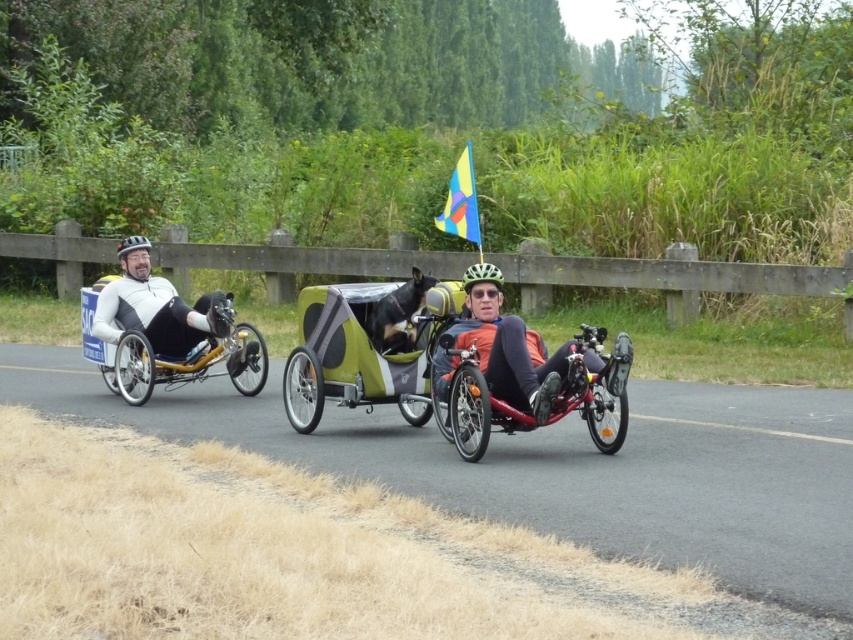
Between matte black wheelchair at left and white matte cycling suit at left, which one has more height?

matte black wheelchair at left is taller.

Between matte black wheelchair at left and white matte cycling suit at left, which one appears on the left side from the viewer's perspective?

Positioned to the left is matte black wheelchair at left.

I want to click on matte black wheelchair at left, so click(187, 355).

You are a GUI agent. You are given a task and a screenshot of the screen. Output one action in this format:
    pyautogui.click(x=<x>, y=<y>)
    Task: Click on the matte black wheelchair at left
    The image size is (853, 640).
    Given the screenshot: What is the action you would take?
    click(187, 355)

Who is more distant from viewer, (431, 406) or (479, 362)?

The point (431, 406) is more distant.

Looking at this image, is green textured cargo bike at center positioned before orange fabric trike at center?

No, it is not.

Who is more forward, (384, 292) or (473, 317)?

Point (473, 317)

Locate an element on the screen. The width and height of the screenshot is (853, 640). green textured cargo bike at center is located at coordinates (352, 355).

Between matte black wheelchair at left and orange fabric trike at center, which one has more height?

With more height is matte black wheelchair at left.

Does matte black wheelchair at left come behind orange fabric trike at center?

Yes.

Which is in front, point (257, 339) or point (468, 301)?

Point (468, 301)

In order to click on matte black wheelchair at left in this screenshot , I will do `click(187, 355)`.